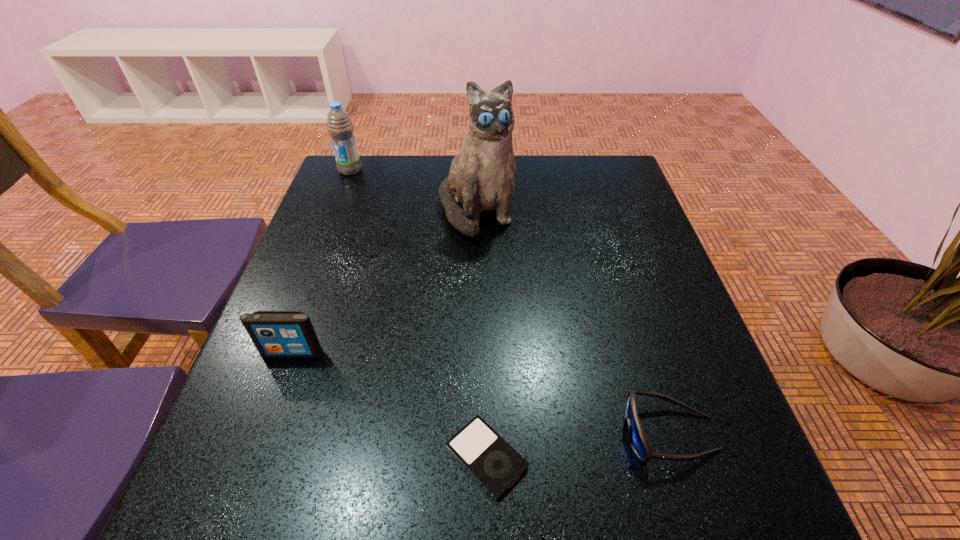
Locate an element on the screen. This screenshot has height=540, width=960. object that stands as the second closest to the cat is located at coordinates (276, 334).

Identify which object is the closest to the shorter iPod. Please provide its 2D coordinates. Your answer should be formatted as a tuple, i.e. [(x, y)], where the tuple contains the x and y coordinates of a point satisfying the conditions above.

[(638, 440)]

Where is `vacant space that satisfies the following two spatial constraints: 1. on the front-facing side of the rightmost object; 2. on the front side of the shortest object`? vacant space that satisfies the following two spatial constraints: 1. on the front-facing side of the rightmost object; 2. on the front side of the shortest object is located at coordinates click(x=677, y=456).